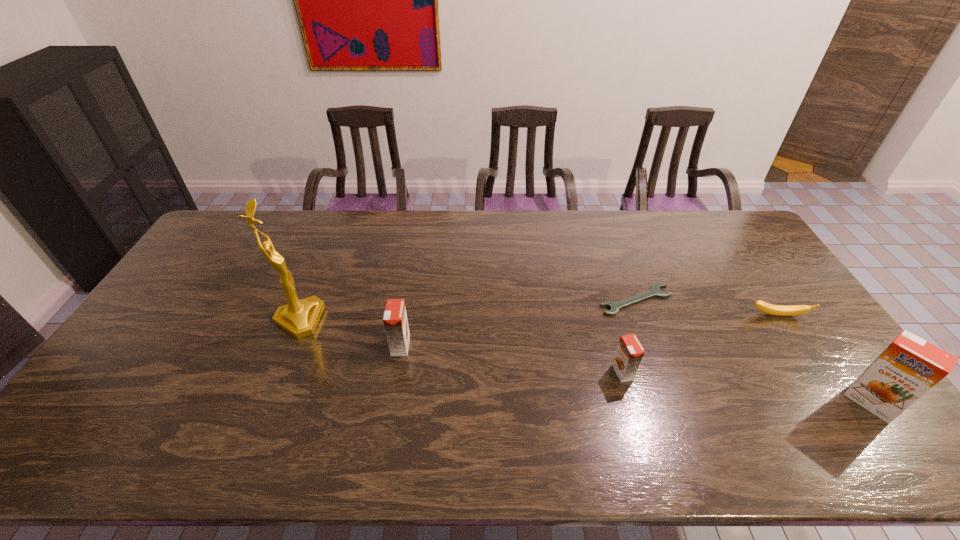
Identify the location of vacant area between the banana and the rightmost orange juice. (825, 359).

You are a GUI agent. You are given a task and a screenshot of the screen. Output one action in this format:
    pyautogui.click(x=<x>, y=<y>)
    Task: Click on the vacant space in between the shortest object and the tallest orange juice
    
    Given the screenshot: What is the action you would take?
    pyautogui.click(x=754, y=351)

Identify the location of vacant space in between the award and the wrench. The width and height of the screenshot is (960, 540). (468, 310).

Locate an element on the screen. Image resolution: width=960 pixels, height=540 pixels. object that is the second nearest to the third shortest object is located at coordinates (778, 310).

Locate which object is the second closest to the leftmost object. Please provide its 2D coordinates. Your answer should be formatted as a tuple, i.e. [(x, y)], where the tuple contains the x and y coordinates of a point satisfying the conditions above.

[(629, 353)]

Where is `orange juice identified as the third closest to the banana`? orange juice identified as the third closest to the banana is located at coordinates [395, 321].

Identify which orange juice is the second nearest to the shortest object. Please provide its 2D coordinates. Your answer should be formatted as a tuple, i.e. [(x, y)], where the tuple contains the x and y coordinates of a point satisfying the conditions above.

[(910, 366)]

The image size is (960, 540). I want to click on free point that satisfies the following two spatial constraints: 1. at the stem of the banana; 2. on the front-facing side of the tallest object, so click(780, 320).

The image size is (960, 540). Find the location of `free location that satisfies the following two spatial constraints: 1. on the back side of the leftmost orange juice; 2. on the front-facing side of the leftmost object`. free location that satisfies the following two spatial constraints: 1. on the back side of the leftmost orange juice; 2. on the front-facing side of the leftmost object is located at coordinates (405, 320).

Locate an element on the screen. This screenshot has height=540, width=960. vacant region that satisfies the following two spatial constraints: 1. on the front-facing side of the farthest orange juice; 2. on the left side of the leftmost object is located at coordinates (289, 346).